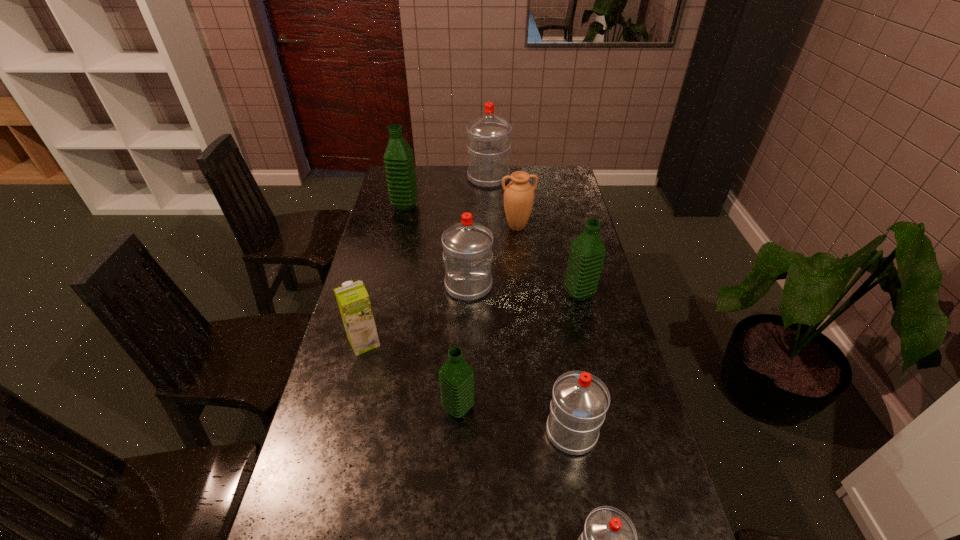
This screenshot has width=960, height=540. I want to click on vacant area that satisfies the following two spatial constraints: 1. on the handle side of the second farthest white water bottle; 2. on the right side of the second biggest green water bottle, so click(468, 294).

Identify the location of blank area in the image that satisfies the following two spatial constraints: 1. on the back side of the sixth farthest object; 2. on the left side of the leftmost green water bottle. Image resolution: width=960 pixels, height=540 pixels. [398, 206].

Find the location of a particular element. The width and height of the screenshot is (960, 540). vacant area in the image that satisfies the following two spatial constraints: 1. on the handle side of the second nearest green water bottle; 2. on the right side of the second farthest white water bottle is located at coordinates (468, 294).

Find the location of `vacant position in the image that satisfies the following two spatial constraints: 1. on the front side of the eighth nearest object; 2. on the right side of the second nearest green water bottle`. vacant position in the image that satisfies the following two spatial constraints: 1. on the front side of the eighth nearest object; 2. on the right side of the second nearest green water bottle is located at coordinates (385, 294).